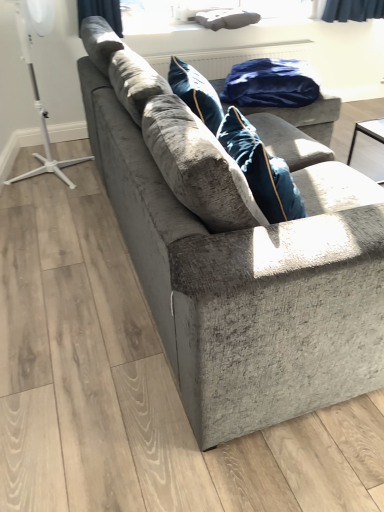
Question: Relative to transparent glass window screen at upper center, is blue velvet blanket at upper center in front or behind?

Choices:
 (A) behind
 (B) front

Answer: (B)

Question: Looking at the image, does blue velvet blanket at upper center seem bigger or smaller compared to transparent glass window screen at upper center?

Choices:
 (A) big
 (B) small

Answer: (A)

Question: Estimate the real-world distances between objects in this image. Which object is farther from the white plastic tripod at left?

Choices:
 (A) velvet gray couch at center
 (B) transparent glass window screen at upper center
 (C) blue velvet blanket at upper center

Answer: (A)

Question: Based on their relative distances, which object is nearer to the transparent glass window screen at upper center?

Choices:
 (A) white plastic tripod at left
 (B) blue velvet blanket at upper center
 (C) velvet gray couch at center

Answer: (B)